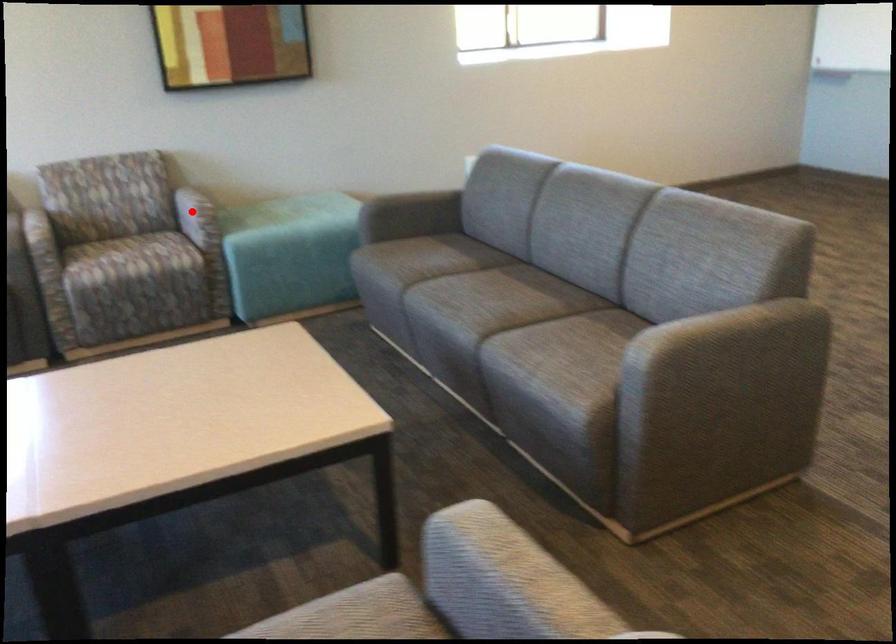
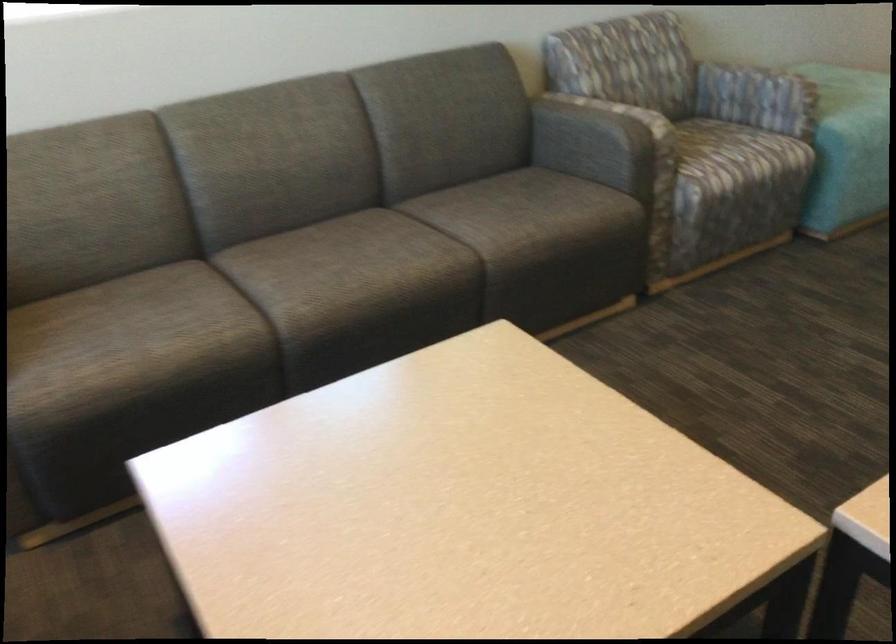
Find the pixel in the second image that matches the highlighted location in the first image.

(728, 84)